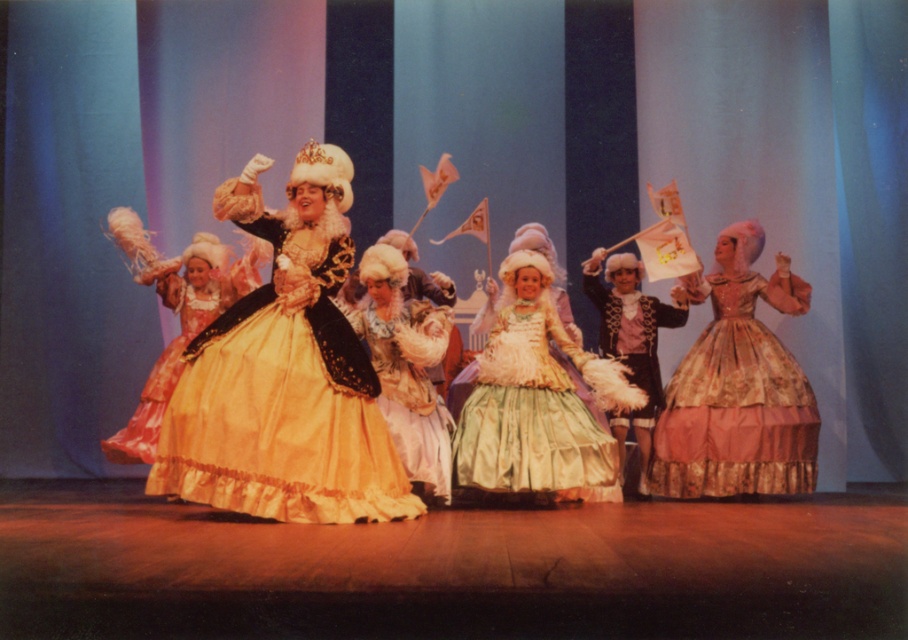
You are an audience member sitting in the front row of the theater. You notice a point at coordinates [280,374] on the stage. What object is located at that point?

The point at coordinates [280,374] corresponds to the silk gold gown at center.